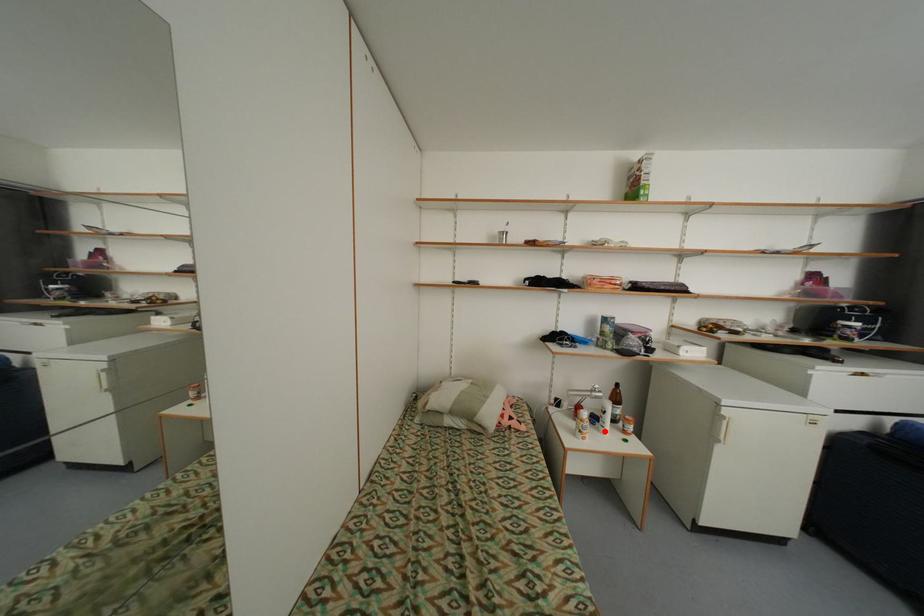
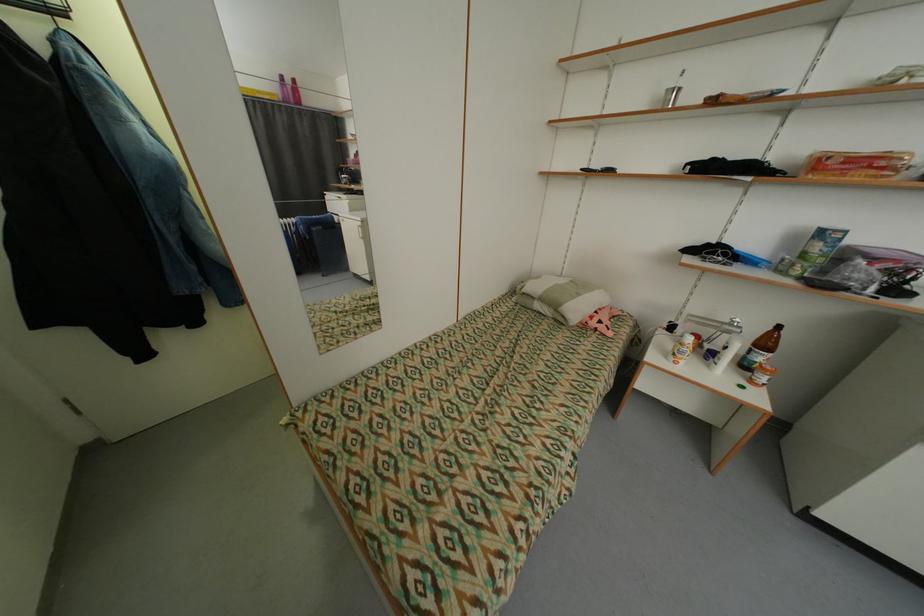
The point at the highlighted location is marked in the first image. Where is the corresponding point in the second image?

(714, 367)